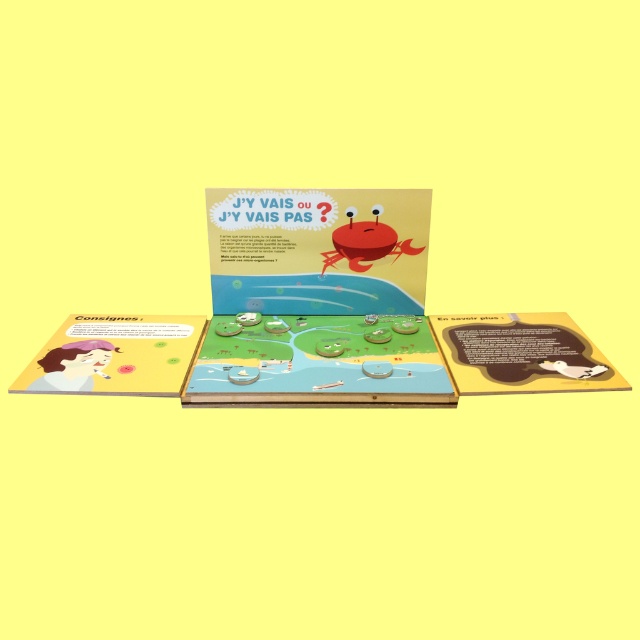
You are a child trying to find the game board for a new game. You see the matte plastic game board at center and the brown matte book at lower right. Which object is positioned lower in the image?

The matte plastic game board at center is located below the brown matte book at lower right, so it is positioned lower in the image.

Based on the photo, you are looking at an open childrens book with two points marked on its pages. The points are labeled as point (65, 333) and point (531, 336). Which of these two points is closer to you?

Point (65, 333) is closer to the camera than point (531, 336).

You are a child trying to place a sticker on the book. The sticker is meant to go on the page with the crab. Which object should you look for first, the matte yellow paper at lower left or the brown matte book at lower right?

The sticker should be placed on the brown matte book at lower right, as the crab illustration is on that side of the book.